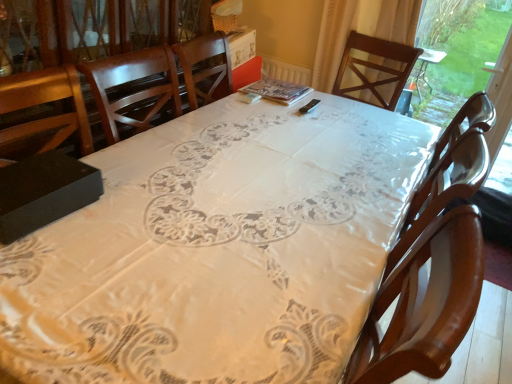
Where is `wooden chair at center`? The width and height of the screenshot is (512, 384). wooden chair at center is located at coordinates (429, 276).

Image resolution: width=512 pixels, height=384 pixels. Describe the element at coordinates (429, 276) in the screenshot. I see `wooden chair at center` at that location.

Where is `transparent plastic window screen at right`? The width and height of the screenshot is (512, 384). transparent plastic window screen at right is located at coordinates (459, 52).

Where is `white lace tablecloth at center`? The image size is (512, 384). white lace tablecloth at center is located at coordinates (218, 249).

The height and width of the screenshot is (384, 512). Describe the element at coordinates (44, 192) in the screenshot. I see `black matte box at lower left` at that location.

Image resolution: width=512 pixels, height=384 pixels. What are the coordinates of `black matte box at lower left` in the screenshot? It's located at (44, 192).

The width and height of the screenshot is (512, 384). I want to click on wooden chair at center, so pos(429,276).

Is white lace tablecloth at center in front of or behind transparent plastic window screen at right in the image?

white lace tablecloth at center is in front of transparent plastic window screen at right.

Is white lace tablecloth at center to the left or to the right of transparent plastic window screen at right in the image?

In the image, white lace tablecloth at center appears on the left side of transparent plastic window screen at right.

Is white lace tablecloth at center positioned with its back to transparent plastic window screen at right?

white lace tablecloth at center does not have its back to transparent plastic window screen at right.

Which of these two, white lace tablecloth at center or transparent plastic window screen at right, is wider?

white lace tablecloth at center.

Between black matte box at lower left and wooden chair at center, which one has smaller width?

black matte box at lower left.

From the image's perspective, between black matte box at lower left and wooden chair at center, who is located below?

From the image's view, wooden chair at center is below.

Is black matte box at lower left beside wooden chair at center?

black matte box at lower left and wooden chair at center are clearly separated.

Where is `chair below the black matte box at lower left (from the image's perspective)`? The image size is (512, 384). chair below the black matte box at lower left (from the image's perspective) is located at coordinates (429, 276).

Could you tell me if transparent plastic window screen at right is facing black matte box at lower left?

Yes, transparent plastic window screen at right is facing black matte box at lower left.

How different are the orientations of transparent plastic window screen at right and black matte box at lower left in degrees?

91.5 degrees separate the facing orientations of transparent plastic window screen at right and black matte box at lower left.

Does transparent plastic window screen at right appear on the left side of black matte box at lower left?

Incorrect, transparent plastic window screen at right is not on the left side of black matte box at lower left.

From the image's perspective, which one is positioned higher, transparent plastic window screen at right or black matte box at lower left?

transparent plastic window screen at right is shown above in the image.

From a real-world perspective, is white lace tablecloth at center physically located above or below black matte box at lower left?

From a real-world perspective, white lace tablecloth at center is physically below black matte box at lower left.

Is the position of white lace tablecloth at center more distant than that of black matte box at lower left?

No, it is in front of black matte box at lower left.

Do you think white lace tablecloth at center is within black matte box at lower left, or outside of it?

white lace tablecloth at center cannot be found inside black matte box at lower left.

How many degrees apart are the facing directions of black matte box at lower left and transparent plastic window screen at right?

There is a 91.5-degree angle between the facing directions of black matte box at lower left and transparent plastic window screen at right.

Can you confirm if black matte box at lower left is smaller than transparent plastic window screen at right?

Correct, black matte box at lower left occupies less space than transparent plastic window screen at right.

Between black matte box at lower left and transparent plastic window screen at right, which one has larger width?

Wider between the two is black matte box at lower left.

From a real-world perspective, is transparent plastic window screen at right physically above wooden chair at center?

Correct, in the physical world, transparent plastic window screen at right is higher than wooden chair at center.

From the image's perspective, would you say transparent plastic window screen at right is positioned over wooden chair at center?

Yes, from the image's perspective, transparent plastic window screen at right is on top of wooden chair at center.

Considering the sizes of objects transparent plastic window screen at right and wooden chair at center in the image provided, who is taller, transparent plastic window screen at right or wooden chair at center?

transparent plastic window screen at right is taller.

Could you tell me if transparent plastic window screen at right is turned towards wooden chair at center?

Yes, transparent plastic window screen at right faces towards wooden chair at center.

Does point (434, 14) appear closer or farther from the camera than point (347, 334)?

Point (434, 14) is farther from the camera than point (347, 334).

From a real-world perspective, is transparent plastic window screen at right located beneath white lace tablecloth at center?

No, from a real-world perspective, transparent plastic window screen at right is not beneath white lace tablecloth at center.

What are the coordinates of `window screen located above the white lace tablecloth at center (from a real-world perspective)` in the screenshot? It's located at (459, 52).

Is transparent plastic window screen at right directly adjacent to white lace tablecloth at center?

They are not placed beside each other.

Where is `window screen above the white lace tablecloth at center (from the image's perspective)`? The height and width of the screenshot is (384, 512). window screen above the white lace tablecloth at center (from the image's perspective) is located at coordinates (459, 52).

I want to click on box in front of the wooden chair at center, so click(44, 192).

Consider the image. Looking at the image, which one is located further to white lace tablecloth at center, transparent plastic window screen at right or wooden chair at center?

Based on the image, transparent plastic window screen at right appears to be further to white lace tablecloth at center.

Which object lies nearer to the anchor point transparent plastic window screen at right, white lace tablecloth at center or black matte box at lower left?

Among the two, white lace tablecloth at center is located nearer to transparent plastic window screen at right.

Considering their positions, is black matte box at lower left positioned further to transparent plastic window screen at right than white lace tablecloth at center?

black matte box at lower left is further to transparent plastic window screen at right.

When comparing their distances from transparent plastic window screen at right, does wooden chair at center or white lace tablecloth at center seem further?

white lace tablecloth at center is positioned further to the anchor transparent plastic window screen at right.

Estimate the real-world distances between objects in this image. Which object is closer to wooden chair at center, transparent plastic window screen at right or white lace tablecloth at center?

Based on the image, white lace tablecloth at center appears to be nearer to wooden chair at center.

From the image, which object appears to be nearer to black matte box at lower left, wooden chair at center or white lace tablecloth at center?

white lace tablecloth at center lies closer to black matte box at lower left than the other object.

Looking at this image, looking at the image, which one is located closer to black matte box at lower left, transparent plastic window screen at right or white lace tablecloth at center?

Based on the image, white lace tablecloth at center appears to be nearer to black matte box at lower left.

Based on their spatial positions, is wooden chair at center or black matte box at lower left further from white lace tablecloth at center?

wooden chair at center is positioned further to the anchor white lace tablecloth at center.

The image size is (512, 384). Identify the location of table between black matte box at lower left and transparent plastic window screen at right. (218, 249).

Locate an element on the screen. The width and height of the screenshot is (512, 384). chair between white lace tablecloth at center and transparent plastic window screen at right from front to back is located at coordinates (429, 276).

You are a GUI agent. You are given a task and a screenshot of the screen. Output one action in this format:
    pyautogui.click(x=<x>, y=<y>)
    Task: Click on the chair between black matte box at lower left and transparent plastic window screen at right from left to right
    The width and height of the screenshot is (512, 384).
    Given the screenshot: What is the action you would take?
    pyautogui.click(x=429, y=276)

Locate an element on the screen. The height and width of the screenshot is (384, 512). table between black matte box at lower left and wooden chair at center in the horizontal direction is located at coordinates (218, 249).